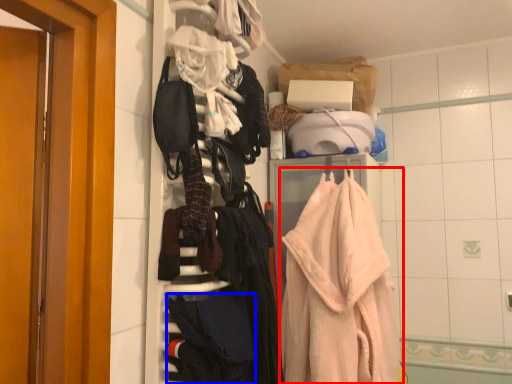
Question: Which object appears closest to the camera in this image, towel (highlighted by a red box) or clothing (highlighted by a blue box)?

Choices:
 (A) towel
 (B) clothing

Answer: (B)